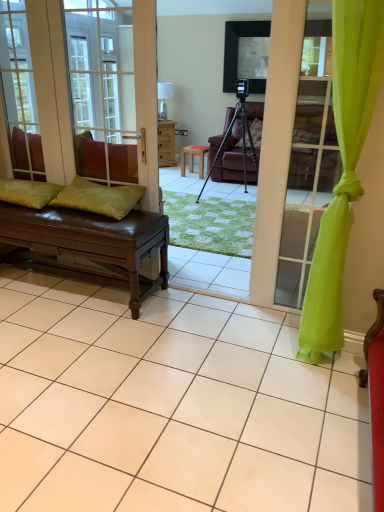
Question: From a real-world perspective, relative to brown leather bench at left, is wooden stool at center vertically above or below?

Choices:
 (A) above
 (B) below

Answer: (B)

Question: Would you say wooden stool at center is inside or outside brown leather bench at left?

Choices:
 (A) outside
 (B) inside

Answer: (A)

Question: Estimate the real-world distances between objects in this image. Which object is closer to the brown leather bench at left?

Choices:
 (A) brown leather bench at left
 (B) clear glass window at left
 (C) wooden stool at center
 (D) green fabric pillow at left, which is the 1th pillow in left-to-right order
 (E) matte black tripod at center

Answer: (D)

Question: Estimate the real-world distances between objects in this image. Which object is closer to the green leather pillow at left, placed as the 2th pillow when sorted from left to right?

Choices:
 (A) lime green fabric at right
 (B) brown leather bench at left
 (C) clear glass window at left
 (D) wooden stool at center
 (E) green fabric pillow at left, the second pillow in the right-to-left sequence

Answer: (E)